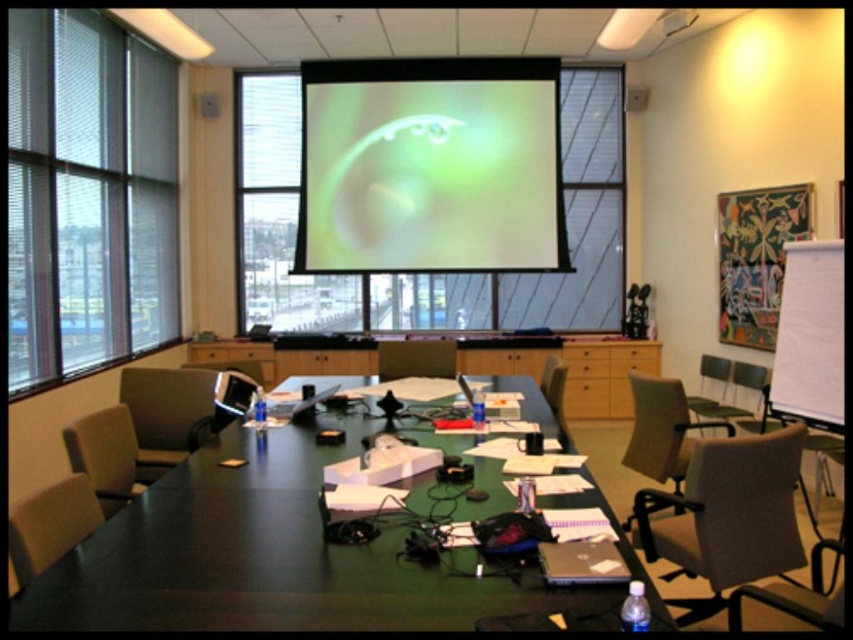
Who is shorter, matte gray chair at left or wooden chair at center?

With less height is wooden chair at center.

Does matte gray chair at left have a larger size compared to wooden chair at center?

Indeed, matte gray chair at left has a larger size compared to wooden chair at center.

What do you see at coordinates (169, 413) in the screenshot? This screenshot has width=853, height=640. I see `matte gray chair at left` at bounding box center [169, 413].

The width and height of the screenshot is (853, 640). In order to click on matte gray chair at left in this screenshot , I will do `click(169, 413)`.

Is beige fabric swivel chair at lower right shorter than matte gray chair at lower left?

No.

Find the location of a particular element. This screenshot has width=853, height=640. beige fabric swivel chair at lower right is located at coordinates (726, 516).

Is beige fabric chair at right closer to the viewer compared to matte black chair at center?

Yes, beige fabric chair at right is in front of matte black chair at center.

From the picture: Can you confirm if beige fabric chair at right is wider than matte black chair at center?

Yes.

Who is more forward, (640, 472) or (426, 342)?

Point (640, 472) is more forward.

This screenshot has height=640, width=853. Find the location of `beige fabric chair at right`. beige fabric chair at right is located at coordinates (662, 429).